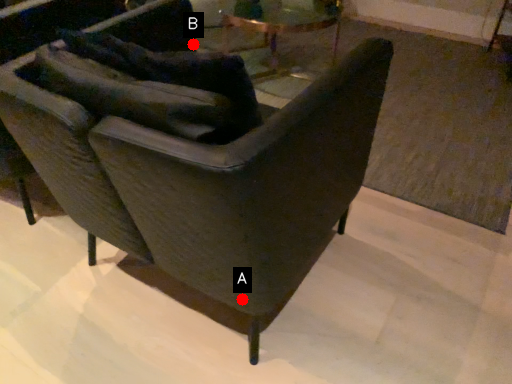
Question: Two points are circled on the image, labeled by A and B beside each circle. Which point is closer to the camera taking this photo?

Choices:
 (A) A is closer
 (B) B is closer

Answer: (A)